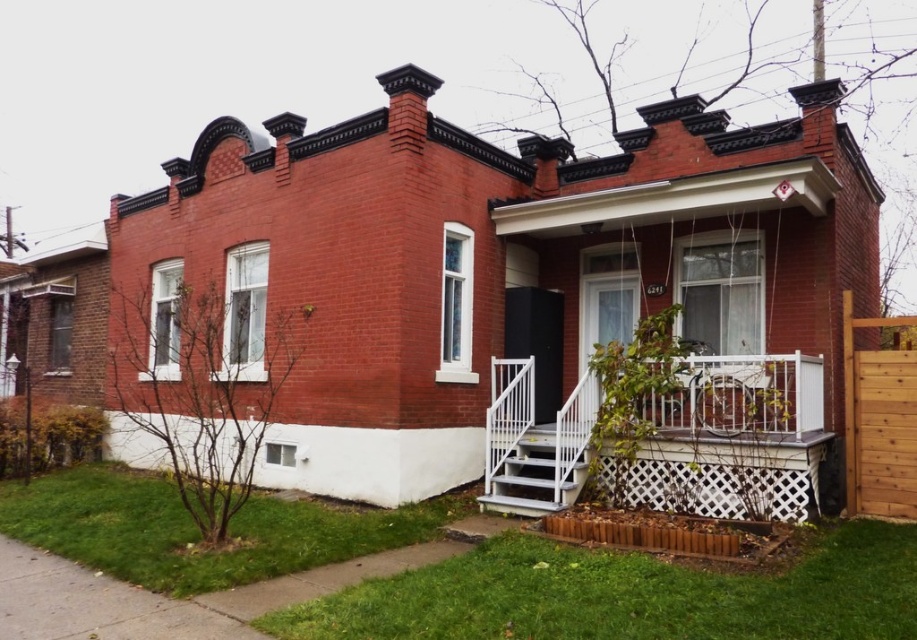
Question: Can you confirm if white lattice porch at center is positioned to the left of white painted wood stairs at lower center?

Choices:
 (A) no
 (B) yes

Answer: (A)

Question: Which point is farther to the camera?

Choices:
 (A) white painted wood stairs at lower center
 (B) white lattice porch at center

Answer: (A)

Question: Does white lattice porch at center have a larger size compared to white painted wood stairs at lower center?

Choices:
 (A) no
 (B) yes

Answer: (B)

Question: Among these objects, which one is farthest from the camera?

Choices:
 (A) white lattice porch at center
 (B) white painted wood stairs at lower center

Answer: (B)

Question: Which of the following is the farthest from the observer?

Choices:
 (A) (518, 438)
 (B) (512, 493)

Answer: (A)

Question: Is white lattice porch at center in front of white painted wood stairs at lower center?

Choices:
 (A) no
 (B) yes

Answer: (B)